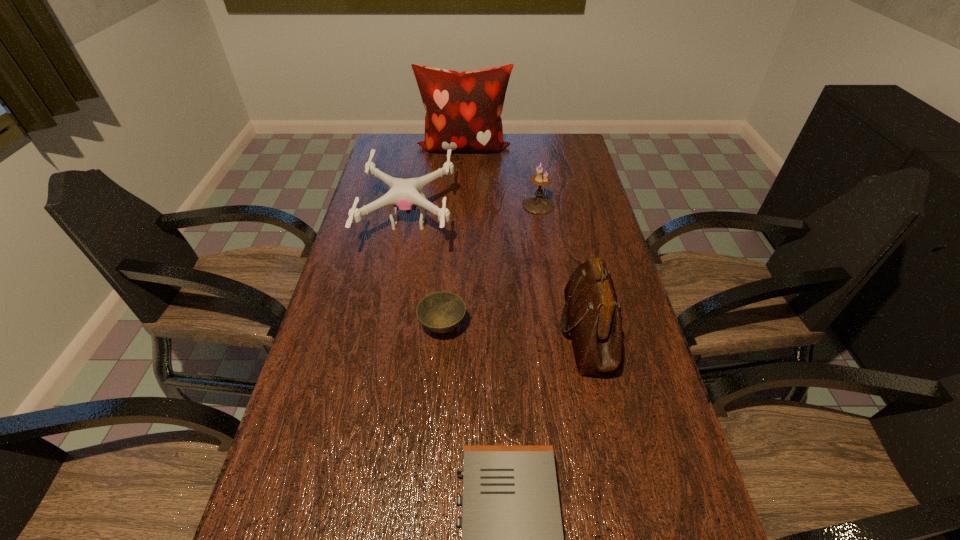
At what (x,y) coordinates should I click in order to perform the action: click on the farthest object. Please return your answer as a coordinate pair (x, y). The width and height of the screenshot is (960, 540). Looking at the image, I should click on (463, 109).

Locate an element on the screen. cushion is located at coordinates (463, 109).

This screenshot has width=960, height=540. Find the location of `the second tallest object`. the second tallest object is located at coordinates (593, 314).

The height and width of the screenshot is (540, 960). I want to click on candle holder, so click(x=536, y=204).

Where is `drone`? The image size is (960, 540). drone is located at coordinates (404, 194).

Locate an element on the screen. bowl is located at coordinates coord(440,312).

Where is `blank space located on the front-facing side of the farthest object`? The image size is (960, 540). blank space located on the front-facing side of the farthest object is located at coordinates (461, 195).

The image size is (960, 540). I want to click on vacant space located 0.260m on the front of the shoulder bag, so click(626, 501).

Where is `vacant space located 0.190m on the left of the candle holder`? vacant space located 0.190m on the left of the candle holder is located at coordinates tap(467, 205).

The image size is (960, 540). I want to click on free spot located on the top of the drone, so [551, 222].